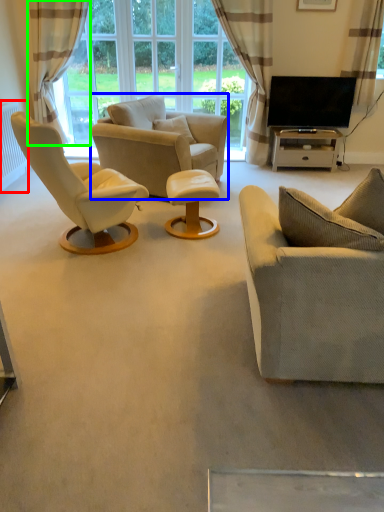
Question: Which is nearer to the radiator (highlighted by a red box)? chair (highlighted by a blue box) or curtain (highlighted by a green box).

Choices:
 (A) chair
 (B) curtain

Answer: (B)